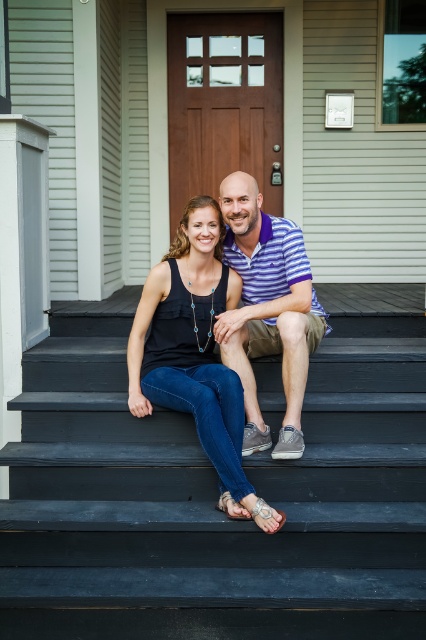
Question: Does smooth black stairs at center have a smaller size compared to matte black tank top at center?

Choices:
 (A) no
 (B) yes

Answer: (A)

Question: Which object is the farthest from the matte black tank top at center?

Choices:
 (A) striped cotton polo shirt at center
 (B) smooth black stairs at center

Answer: (B)

Question: Observing the image, what is the correct spatial positioning of smooth black stairs at center in reference to striped cotton polo shirt at center?

Choices:
 (A) below
 (B) above

Answer: (A)

Question: Estimate the real-world distances between objects in this image. Which object is closer to the matte black tank top at center?

Choices:
 (A) smooth black stairs at center
 (B) striped cotton polo shirt at center

Answer: (B)

Question: Can you confirm if smooth black stairs at center is thinner than matte black tank top at center?

Choices:
 (A) yes
 (B) no

Answer: (B)

Question: Estimate the real-world distances between objects in this image. Which object is closer to the smooth black stairs at center?

Choices:
 (A) striped cotton polo shirt at center
 (B) matte black tank top at center

Answer: (B)